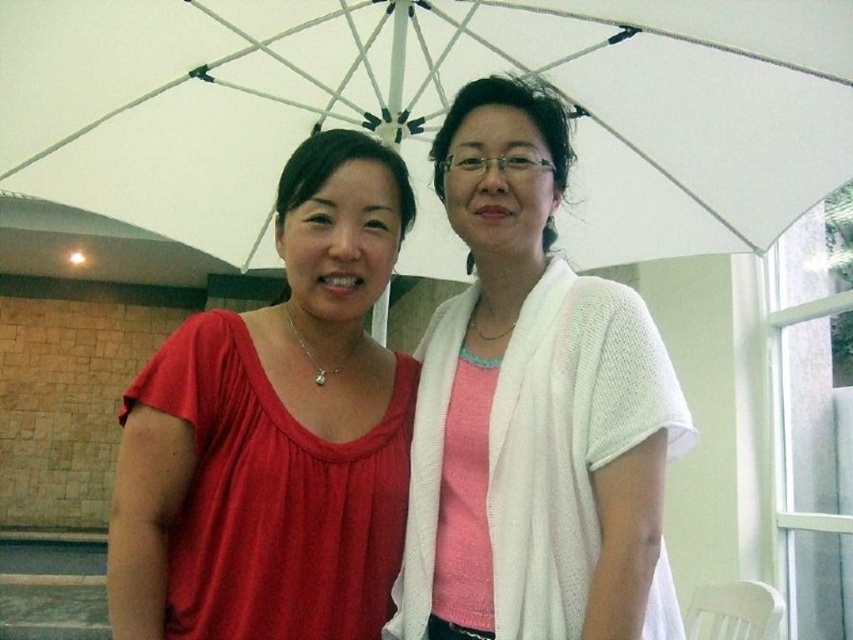
Does white fabric umbrella at upper center have a lesser width compared to white knitted sweater at center?

No.

From the picture: Between white fabric umbrella at upper center and white knitted sweater at center, which one is positioned lower?

Positioned lower is white knitted sweater at center.

Image resolution: width=853 pixels, height=640 pixels. What do you see at coordinates (422, 113) in the screenshot? I see `white fabric umbrella at upper center` at bounding box center [422, 113].

Image resolution: width=853 pixels, height=640 pixels. Identify the location of white fabric umbrella at upper center. (422, 113).

Does white fabric umbrella at upper center appear under matte red blouse at center?

No.

Is point (788, 72) positioned behind point (125, 630)?

Yes, point (788, 72) is farther from viewer.

At what (x,y) coordinates should I click in order to perform the action: click on white fabric umbrella at upper center. Please return your answer as a coordinate pair (x, y). Looking at the image, I should click on (422, 113).

Does white knitted sweater at center have a smaller size compared to matte red blouse at center?

No.

Who is positioned more to the left, white knitted sweater at center or matte red blouse at center?

matte red blouse at center

Measure the distance between white knitted sweater at center and camera.

white knitted sweater at center is 4.00 feet from camera.

Where is `white knitted sweater at center`? The image size is (853, 640). white knitted sweater at center is located at coordinates (532, 412).